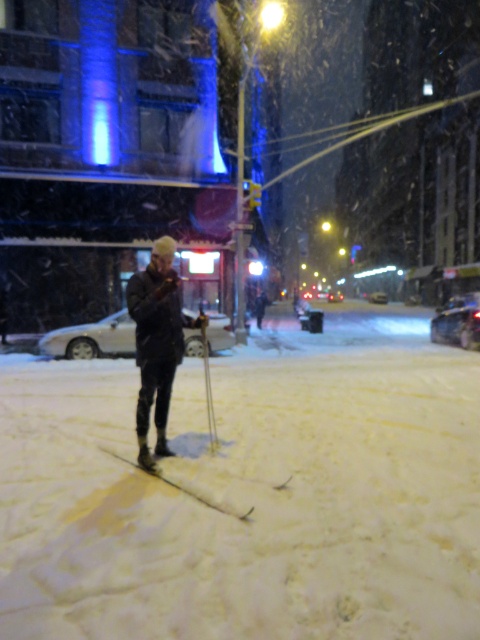
Who is higher up, white fluffy snow at center or white matte ski at center?

white fluffy snow at center is higher up.

Between point (25, 560) and point (168, 477), which one is positioned in front?

Point (25, 560) is more forward.

Is point (225, 506) closer to viewer compared to point (252, 508)?

No.

This screenshot has height=640, width=480. Find the location of `white fluffy snow at center`. white fluffy snow at center is located at coordinates (249, 490).

Which is below, dark gray fabric jacket at center or white matte ski at center?

white matte ski at center is below.

In order to click on dark gray fabric jacket at center in this screenshot , I will do `click(156, 340)`.

The height and width of the screenshot is (640, 480). What do you see at coordinates (156, 340) in the screenshot?
I see `dark gray fabric jacket at center` at bounding box center [156, 340].

Find the location of a particular element. This screenshot has width=480, height=640. dark gray fabric jacket at center is located at coordinates (156, 340).

Can you confirm if white fluffy snow at center is positioned above metallic silver ski pole at center?

Actually, white fluffy snow at center is below metallic silver ski pole at center.

Can you confirm if white fluffy snow at center is shorter than metallic silver ski pole at center?

Correct, white fluffy snow at center is not as tall as metallic silver ski pole at center.

Locate an element on the screen. This screenshot has height=640, width=480. white fluffy snow at center is located at coordinates (249, 490).

Identify the location of white fluffy snow at center. (249, 490).